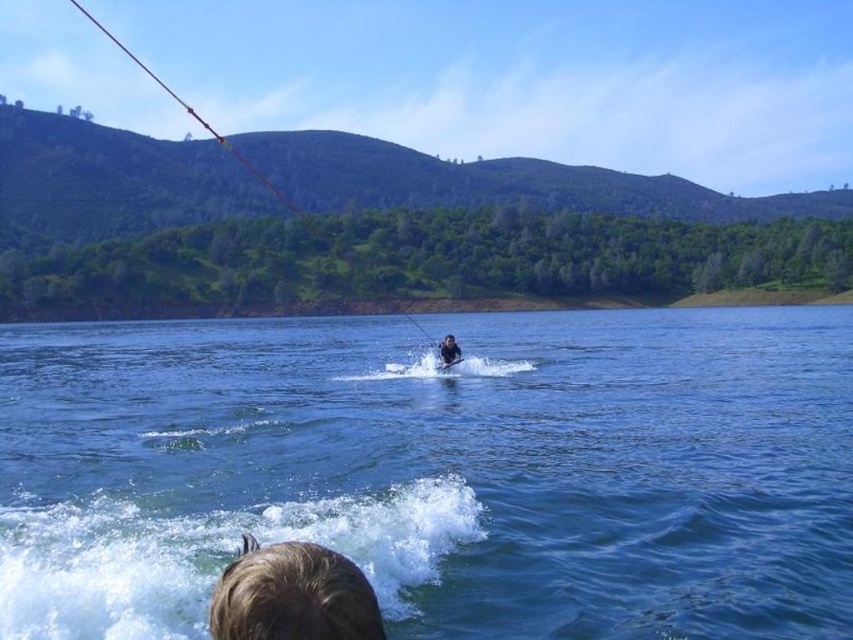
Who is lower down, brown hair at lower center or smooth skin person at center?

Positioned lower is brown hair at lower center.

Is brown hair at lower center further to camera compared to smooth skin person at center?

No, it is not.

The height and width of the screenshot is (640, 853). Find the location of `brown hair at lower center`. brown hair at lower center is located at coordinates pyautogui.click(x=292, y=595).

Describe the element at coordinates (437, 470) in the screenshot. I see `blue liquid water at center` at that location.

Is point (30, 488) positioned behind point (440, 342)?

No, it is in front of (440, 342).

You are a GUI agent. You are given a task and a screenshot of the screen. Output one action in this format:
    pyautogui.click(x=<x>, y=<y>)
    Task: Click on the blue liquid water at center
    The height and width of the screenshot is (640, 853).
    Given the screenshot: What is the action you would take?
    point(437,470)

Between blue liquid water at center and brown hair at lower center, which one has less height?

brown hair at lower center is shorter.

Is blue liquid water at center further to camera compared to brown hair at lower center?

Yes, it is.

In order to click on blue liquid water at center in this screenshot , I will do `click(437, 470)`.